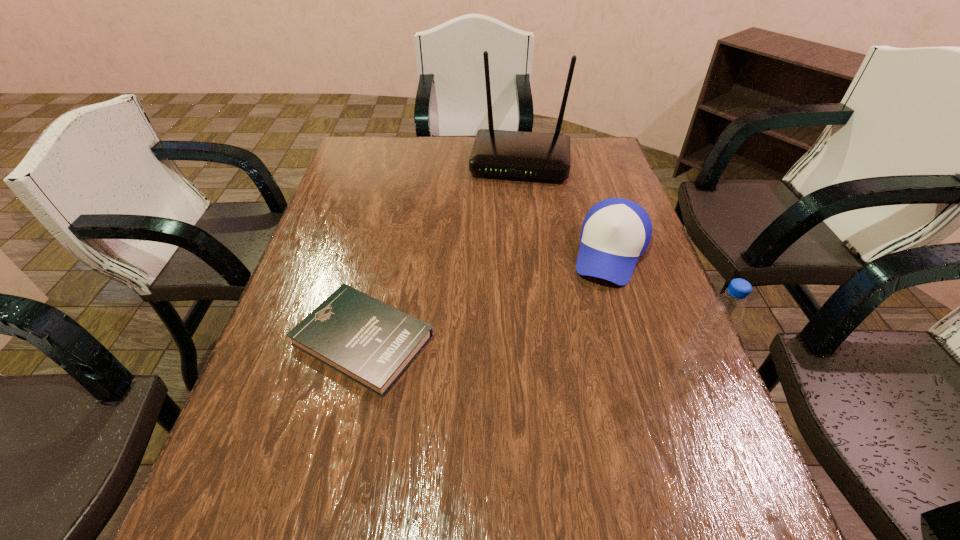
The image size is (960, 540). I want to click on empty space between the water bottle and the baseball cap, so click(x=652, y=311).

At what (x,y) coordinates should I click in order to perform the action: click on empty space between the router and the second shortest object. Please return your answer as a coordinate pair (x, y). This screenshot has height=540, width=960. Looking at the image, I should click on (566, 207).

You are a GUI agent. You are given a task and a screenshot of the screen. Output one action in this format:
    pyautogui.click(x=<x>, y=<y>)
    Task: Click on the free spot between the leftmost object and the baseball cap
    
    Given the screenshot: What is the action you would take?
    pos(488,296)

This screenshot has height=540, width=960. What are the coordinates of `vacant area that lies between the baseball cap and the book` in the screenshot? It's located at (488, 296).

The height and width of the screenshot is (540, 960). In order to click on object that is the third nearest to the book in this screenshot , I will do `click(724, 315)`.

I want to click on the second closest object relative to the baseball cap, so click(x=724, y=315).

You are a GUI agent. You are given a task and a screenshot of the screen. Output one action in this format:
    pyautogui.click(x=<x>, y=<y>)
    Task: Click on the vacant space that satisfies the following two spatial constraints: 1. on the front side of the water bottle; 2. on the right side of the third nearest object
    This screenshot has height=540, width=960.
    Given the screenshot: What is the action you would take?
    pyautogui.click(x=649, y=370)

This screenshot has width=960, height=540. What are the coordinates of `vacant space that satisfies the following two spatial constraints: 1. on the back side of the book; 2. on the right side of the baseball cap` in the screenshot? It's located at (383, 252).